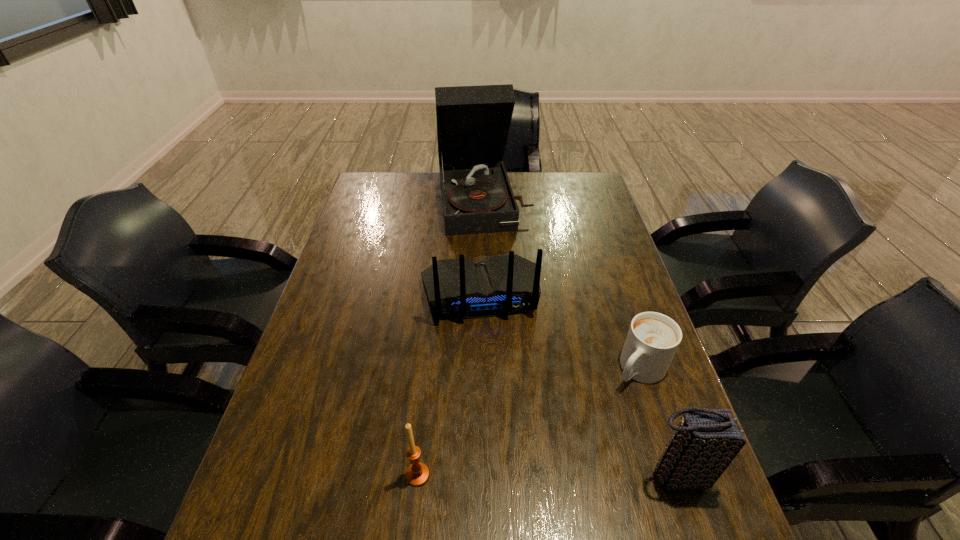
Where is `blank area in the image that satisfies the following two spatial constraints: 1. on the front side of the router; 2. with the zip open on the clutch bag`? blank area in the image that satisfies the following two spatial constraints: 1. on the front side of the router; 2. with the zip open on the clutch bag is located at coordinates (479, 476).

The width and height of the screenshot is (960, 540). I want to click on free space that satisfies the following two spatial constraints: 1. on the back side of the candle_holder; 2. on the left side of the third nearest object, so click(x=429, y=369).